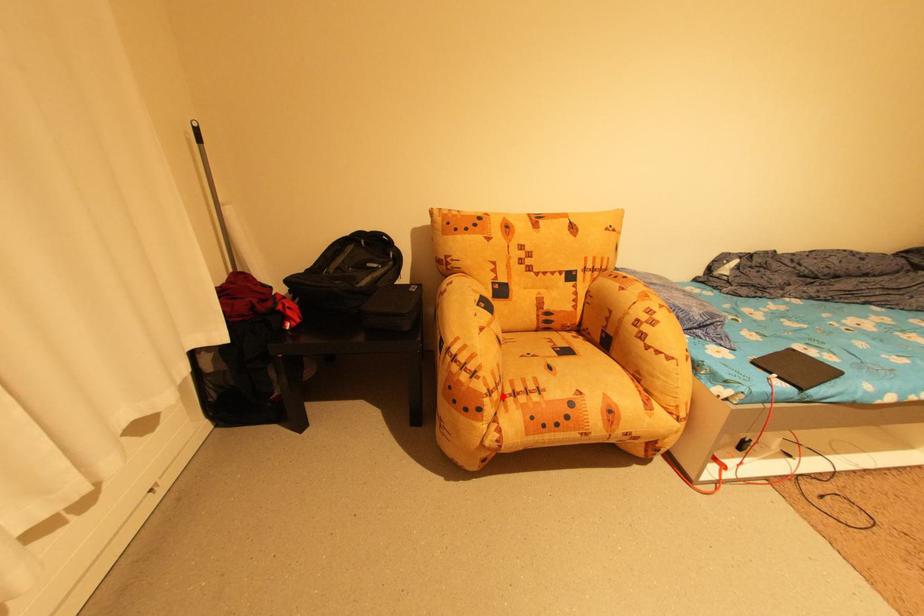
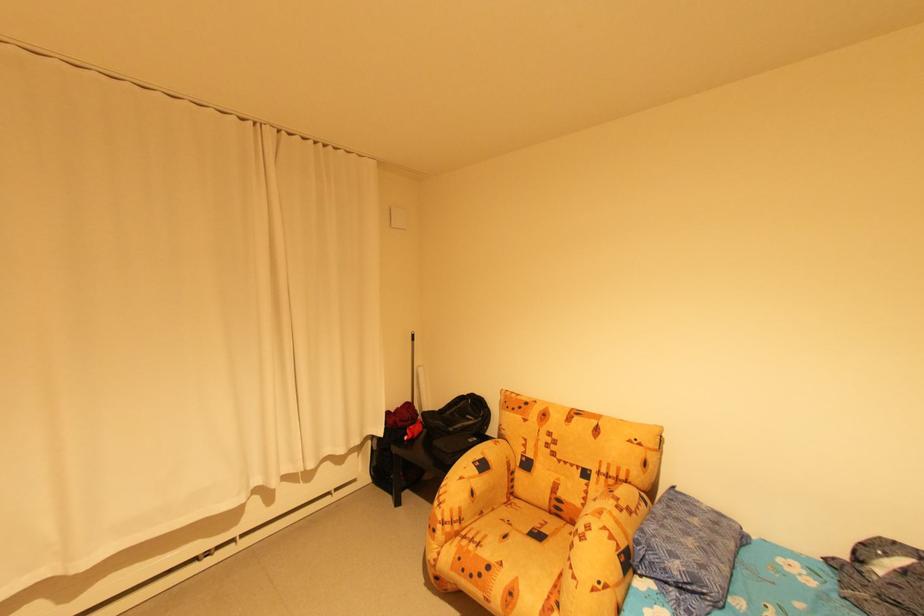
The point at the highlighted location is marked in the first image. Where is the corresponding point in the second image?

(456, 529)